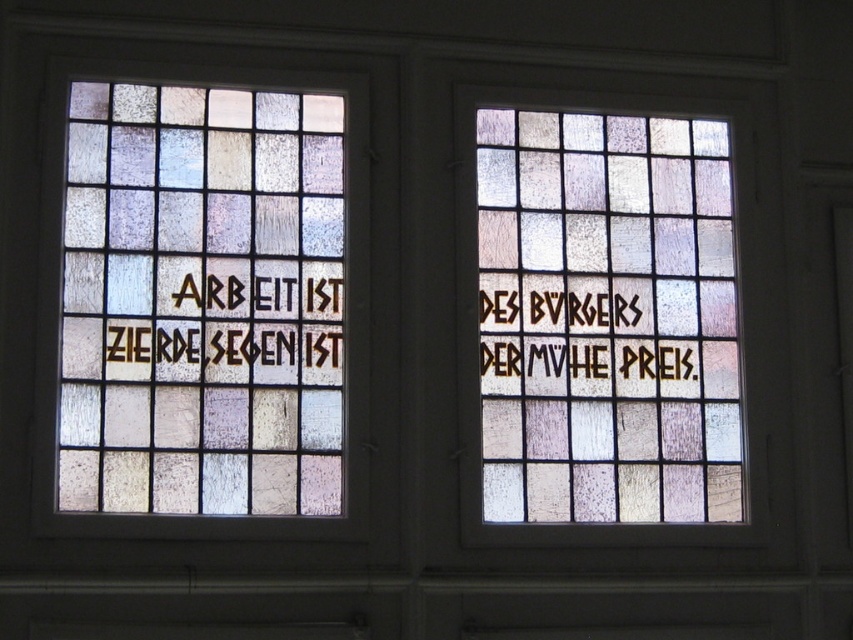
What is the spatial relationship between the translucent stained glass at right and the brown textured glass at left in the image?

The translucent stained glass at right is positioned to the right of the brown textured glass at left.

You are standing in front of the two stained glass windows. Which one, the translucent stained glass at right or the brown textured glass at left, is closer to you?

The translucent stained glass at right is closer to you because it is further to the viewer than the brown textured glass at left.

What is the spatial relationship between the translucent stained glass at left and the other objects in the scene?

The translucent stained glass at left is positioned at coordinates point [201,301], which places it in the center of the left window among the adjacent stained glass windows. It is surrounded by panes of muted colors like blue, purple, and beige, contributing to the soft, diffused light effect described in the scene.